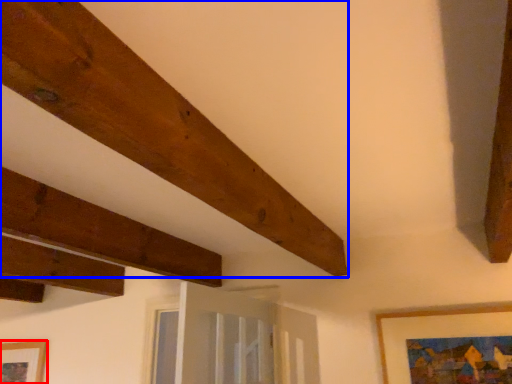
Question: Among these objects, which one is farthest to the camera, picture frame (highlighted by a red box) or plank (highlighted by a blue box)?

Choices:
 (A) picture frame
 (B) plank

Answer: (A)